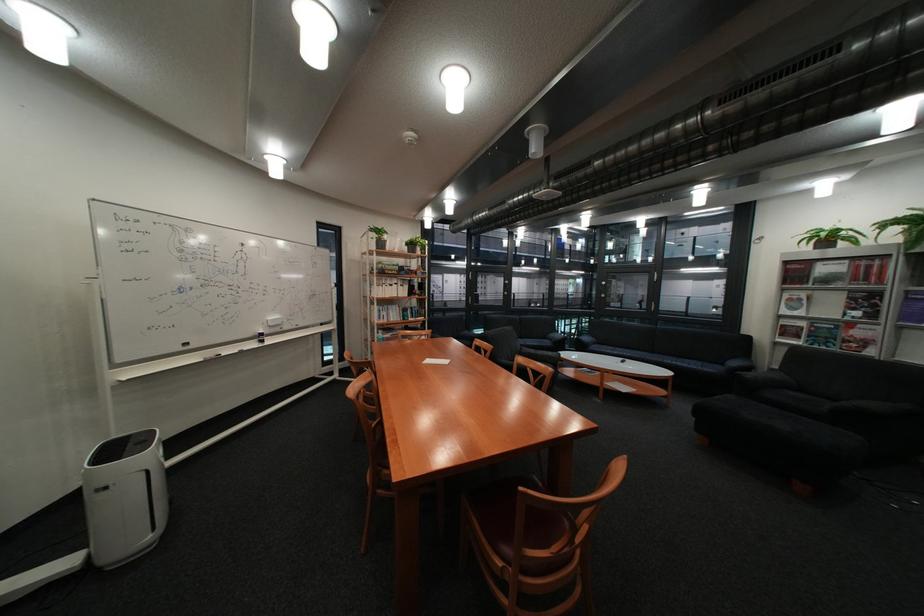
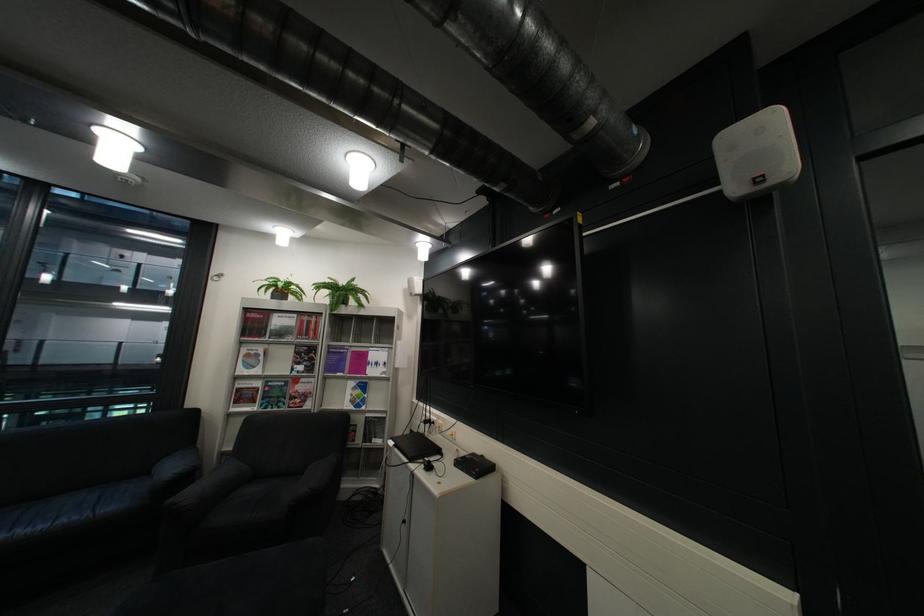
Find the pixel in the second image that matches the point at 831,240 in the first image.

(287, 290)